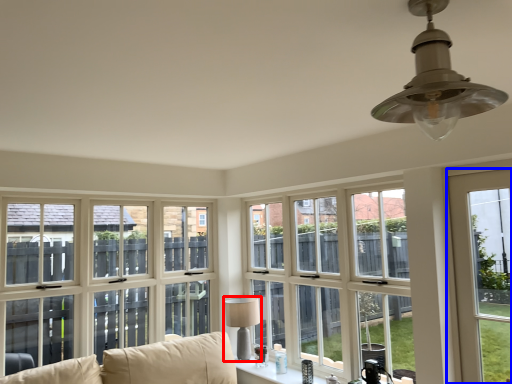
Question: Among these objects, which one is farthest to the camera, lamp (highlighted by a red box) or window (highlighted by a blue box)?

Choices:
 (A) lamp
 (B) window

Answer: (A)